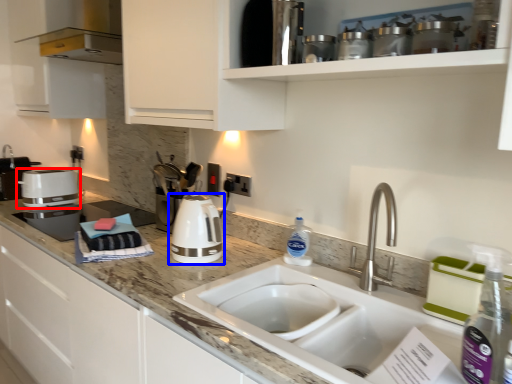
Question: Which object is closer to the camera taking this photo, kitchen appliance (highlighted by a red box) or home appliance (highlighted by a blue box)?

Choices:
 (A) kitchen appliance
 (B) home appliance

Answer: (B)